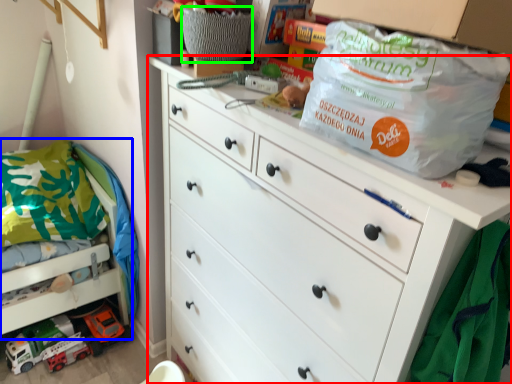
Question: Which is farther away from chest of drawers (highlighted by a red box)? bunk bed (highlighted by a blue box) or basket (highlighted by a green box)?

Choices:
 (A) bunk bed
 (B) basket

Answer: (A)